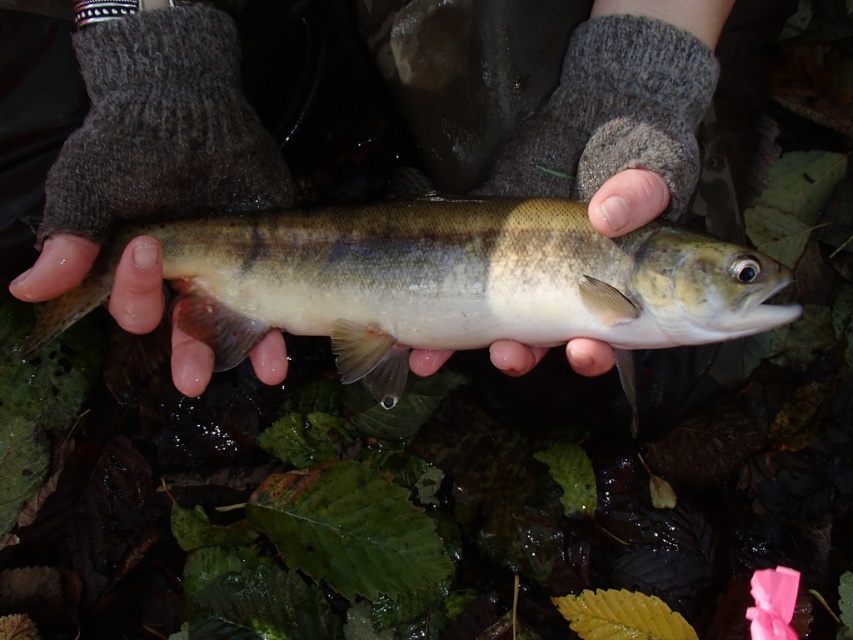
Question: Does shiny silver fish at center have a greater width compared to smooth skin hand at center?

Choices:
 (A) yes
 (B) no

Answer: (A)

Question: Which of the following is the farthest from the observer?

Choices:
 (A) shiny silver fish at center
 (B) smooth skin hand at center

Answer: (A)

Question: Which point is farther to the camera?

Choices:
 (A) shiny silver fish at center
 (B) smooth skin hand at center

Answer: (A)

Question: Which point is farther to the camera?

Choices:
 (A) shiny silver fish at center
 (B) smooth skin hand at center

Answer: (A)

Question: In this image, where is shiny silver fish at center located relative to smooth skin hand at center?

Choices:
 (A) above
 (B) below

Answer: (A)

Question: Can you confirm if shiny silver fish at center is bigger than smooth skin hand at center?

Choices:
 (A) yes
 (B) no

Answer: (A)